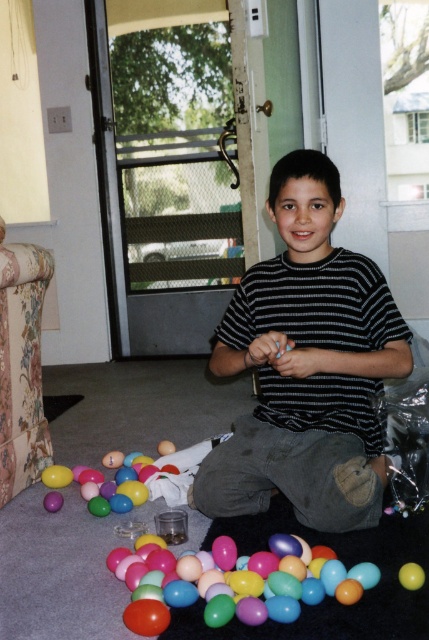
Question: Considering the relative positions of glossy plastic eggs at lower left and smooth yellow ball at lower right in the image provided, where is glossy plastic eggs at lower left located with respect to smooth yellow ball at lower right?

Choices:
 (A) above
 (B) below

Answer: (A)

Question: Which object is farther from the camera taking this photo?

Choices:
 (A) glossy plastic eggs at lower left
 (B) glossy plastic eggs at lower center
 (C) smooth yellow ball at lower right
 (D) black striped shirt at center

Answer: (A)

Question: Is black striped shirt at center bigger than glossy plastic eggs at lower center?

Choices:
 (A) yes
 (B) no

Answer: (A)

Question: Considering the real-world distances, which object is farthest from the smooth yellow ball at lower right?

Choices:
 (A) glossy plastic eggs at lower center
 (B) glossy plastic eggs at lower left
 (C) black striped shirt at center

Answer: (B)

Question: Which of these objects is positioned farthest from the glossy plastic eggs at lower center?

Choices:
 (A) black striped shirt at center
 (B) glossy plastic eggs at lower left

Answer: (B)

Question: Is glossy plastic eggs at lower center smaller than smooth yellow ball at lower right?

Choices:
 (A) yes
 (B) no

Answer: (B)